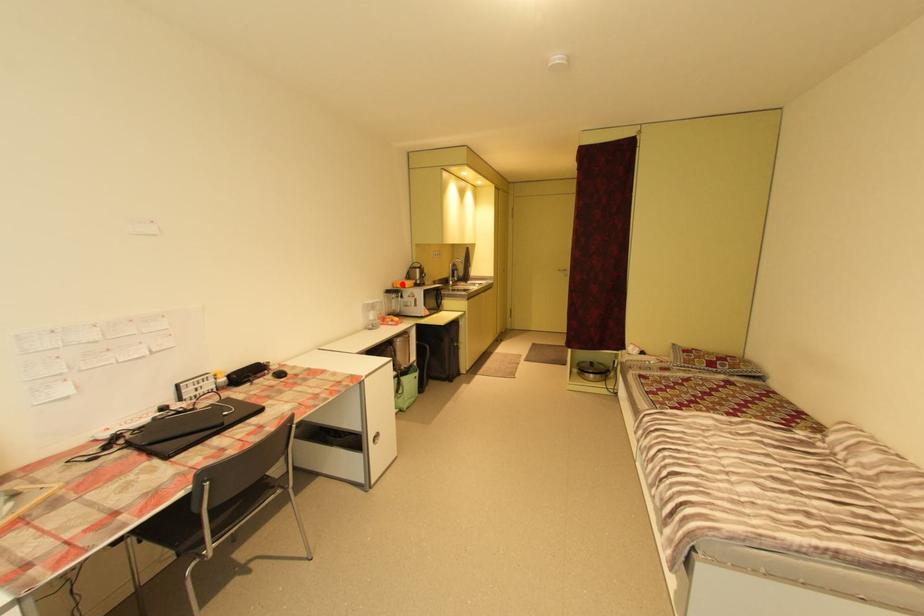
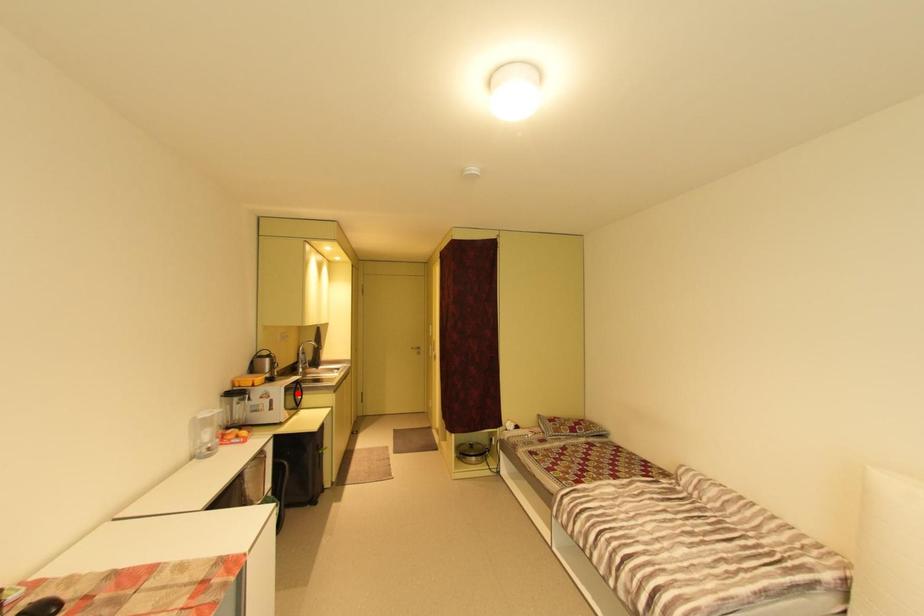
I am providing you with two images of the same scene from different viewpoints. A red point is marked on the first image and another point is marked on the second image. Is the marked point in image1 the same physical position as the marked point in image2?

No